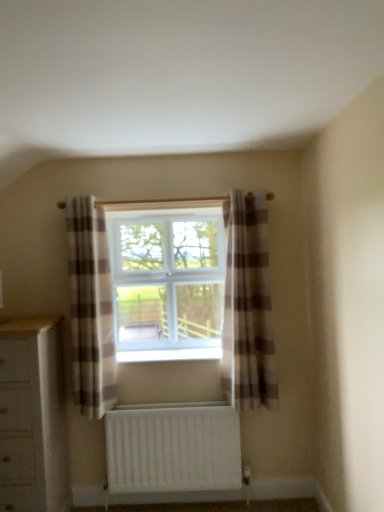
Question: From the image's perspective, is plaid fabric curtain at center, arranged as the second curtain when viewed from the left, above white plastic window sill at center?

Choices:
 (A) yes
 (B) no

Answer: (A)

Question: Is the depth of plaid fabric curtain at center, arranged as the second curtain when viewed from the left, less than that of white plastic window sill at center?

Choices:
 (A) yes
 (B) no

Answer: (A)

Question: From the image's perspective, is plaid fabric curtain at center, which is the first curtain from right to left, beneath white plastic window sill at center?

Choices:
 (A) yes
 (B) no

Answer: (B)

Question: Considering the relative positions of plaid fabric curtain at center, which is the first curtain from right to left, and white plastic window sill at center in the image provided, is plaid fabric curtain at center, which is the first curtain from right to left, to the left of white plastic window sill at center from the viewer's perspective?

Choices:
 (A) no
 (B) yes

Answer: (A)

Question: Can you confirm if plaid fabric curtain at center, which is the first curtain from right to left, is smaller than white plastic window sill at center?

Choices:
 (A) no
 (B) yes

Answer: (A)

Question: From a real-world perspective, is plaid fabric curtain at center, which is the first curtain from right to left, physically above white plastic window sill at center?

Choices:
 (A) no
 (B) yes

Answer: (B)

Question: Can you confirm if plaid fabric curtain at center, arranged as the second curtain when viewed from the left, is thinner than white wood chest of drawers at lower left?

Choices:
 (A) no
 (B) yes

Answer: (B)

Question: Is plaid fabric curtain at center, arranged as the second curtain when viewed from the left, to the right of white wood chest of drawers at lower left from the viewer's perspective?

Choices:
 (A) no
 (B) yes

Answer: (B)

Question: Is plaid fabric curtain at center, which is the first curtain from right to left, located outside white wood chest of drawers at lower left?

Choices:
 (A) no
 (B) yes

Answer: (B)

Question: Considering the relative sizes of plaid fabric curtain at center, which is the first curtain from right to left, and white wood chest of drawers at lower left in the image provided, is plaid fabric curtain at center, which is the first curtain from right to left, bigger than white wood chest of drawers at lower left?

Choices:
 (A) yes
 (B) no

Answer: (B)

Question: Is plaid fabric curtain at center, arranged as the second curtain when viewed from the left, facing away from white wood chest of drawers at lower left?

Choices:
 (A) yes
 (B) no

Answer: (B)

Question: Would you say white wood chest of drawers at lower left is part of plaid fabric curtain at center, arranged as the second curtain when viewed from the left,'s contents?

Choices:
 (A) no
 (B) yes

Answer: (A)

Question: Is white plastic window at center aimed at plaid fabric curtain at center, placed as the 2th curtain when sorted from right to left?

Choices:
 (A) yes
 (B) no

Answer: (A)